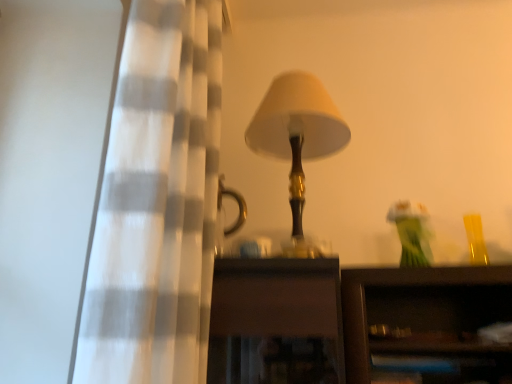
Question: Are matte gold lamp at center and translucent glass vase at upper right far apart?

Choices:
 (A) yes
 (B) no

Answer: (B)

Question: Can you confirm if matte gold lamp at center is shorter than translucent glass vase at upper right?

Choices:
 (A) no
 (B) yes

Answer: (A)

Question: Is matte gold lamp at center placed right next to translucent glass vase at upper right?

Choices:
 (A) no
 (B) yes

Answer: (A)

Question: From the image's perspective, does matte gold lamp at center appear higher than translucent glass vase at upper right?

Choices:
 (A) yes
 (B) no

Answer: (A)

Question: Is matte gold lamp at center further to camera compared to translucent glass vase at upper right?

Choices:
 (A) no
 (B) yes

Answer: (A)

Question: Is matte gold lamp at center in front of translucent glass vase at upper right?

Choices:
 (A) no
 (B) yes

Answer: (B)

Question: Is white checkered curtain at left facing away from matte gold lamp at center?

Choices:
 (A) no
 (B) yes

Answer: (B)

Question: Is white checkered curtain at left beside matte gold lamp at center?

Choices:
 (A) no
 (B) yes

Answer: (A)

Question: Is white checkered curtain at left not close to matte gold lamp at center?

Choices:
 (A) no
 (B) yes

Answer: (A)

Question: Is white checkered curtain at left positioned in front of matte gold lamp at center?

Choices:
 (A) no
 (B) yes

Answer: (B)

Question: From the image's perspective, would you say white checkered curtain at left is shown under matte gold lamp at center?

Choices:
 (A) no
 (B) yes

Answer: (A)

Question: Considering the relative sizes of white checkered curtain at left and matte gold lamp at center in the image provided, is white checkered curtain at left wider than matte gold lamp at center?

Choices:
 (A) no
 (B) yes

Answer: (A)

Question: Is translucent glass vase at upper right further to camera compared to matte gold lamp at center?

Choices:
 (A) no
 (B) yes

Answer: (B)